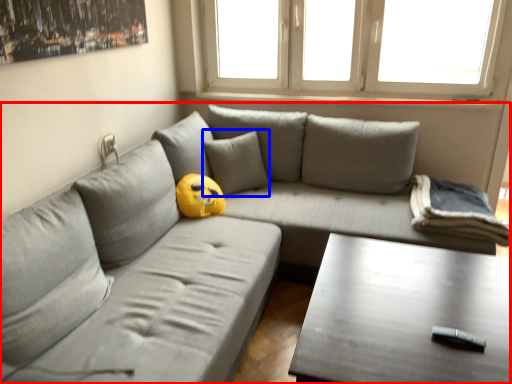
Question: Which point is further to the camera, studio couch (highlighted by a red box) or pillow (highlighted by a blue box)?

Choices:
 (A) studio couch
 (B) pillow

Answer: (B)